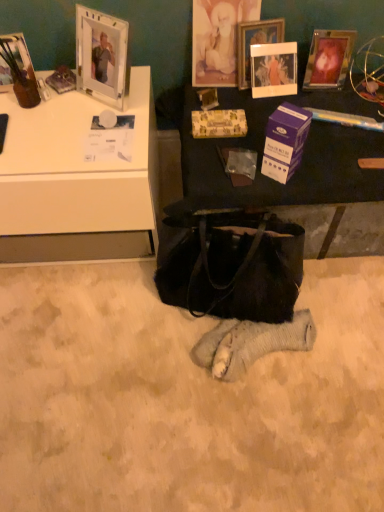
You are a GUI agent. You are given a task and a screenshot of the screen. Output one action in this format:
    pyautogui.click(x=<x>, y=<y>)
    Task: Click on the free location in front of matte glass picture frame at upper left, placed as the first picture frame when sorted from left to right
    The image size is (384, 512).
    Given the screenshot: What is the action you would take?
    pyautogui.click(x=21, y=119)